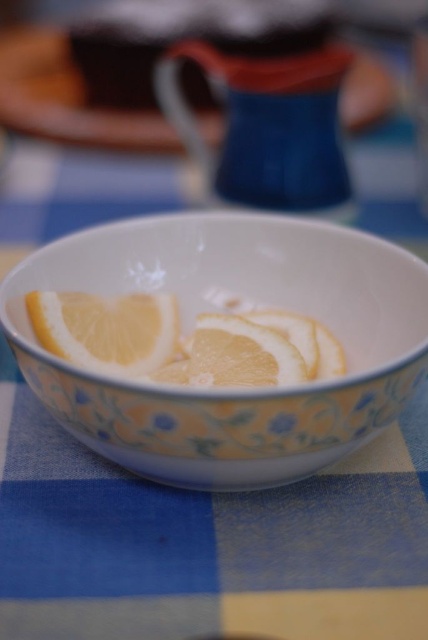
Question: Among these objects, which one is farthest from the camera?

Choices:
 (A) white glossy bowl at center
 (B) yellow matte lemon at center

Answer: (B)

Question: Which point is farther from the camera taking this photo?

Choices:
 (A) (397, 378)
 (B) (235, 337)
 (C) (92, 355)

Answer: (B)

Question: Among these objects, which one is farthest from the camera?

Choices:
 (A) yellow matte orange at center
 (B) yellow matte lemon at center
 (C) white glossy bowl at center

Answer: (B)

Question: Does white glossy bowl at center appear on the left side of yellow matte lemon at center?

Choices:
 (A) no
 (B) yes

Answer: (A)

Question: Observing the image, what is the correct spatial positioning of white glossy bowl at center in reference to yellow matte orange at center?

Choices:
 (A) left
 (B) right

Answer: (A)

Question: Can you confirm if yellow matte lemon at center is positioned above yellow matte orange at center?

Choices:
 (A) no
 (B) yes

Answer: (B)